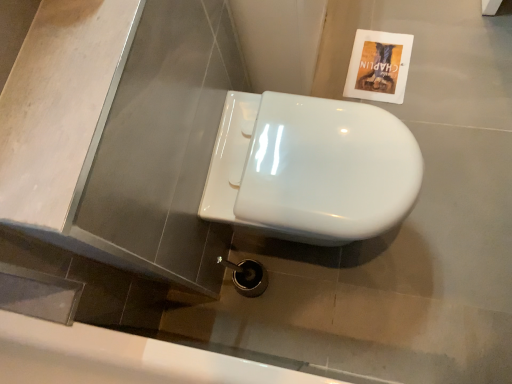
Locate an element on the screen. This screenshot has height=384, width=512. free space to the back side of matte paper flyer at upper right is located at coordinates (352, 22).